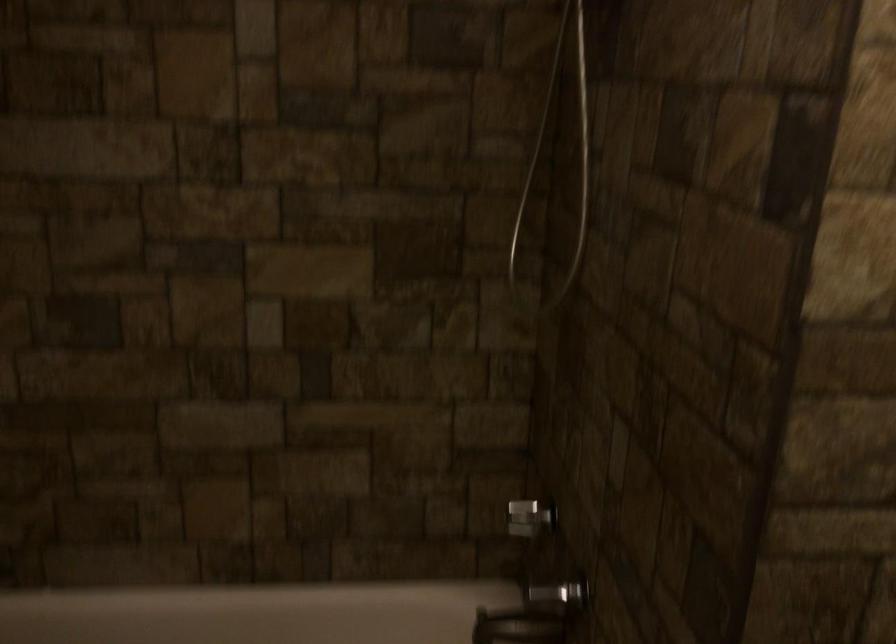
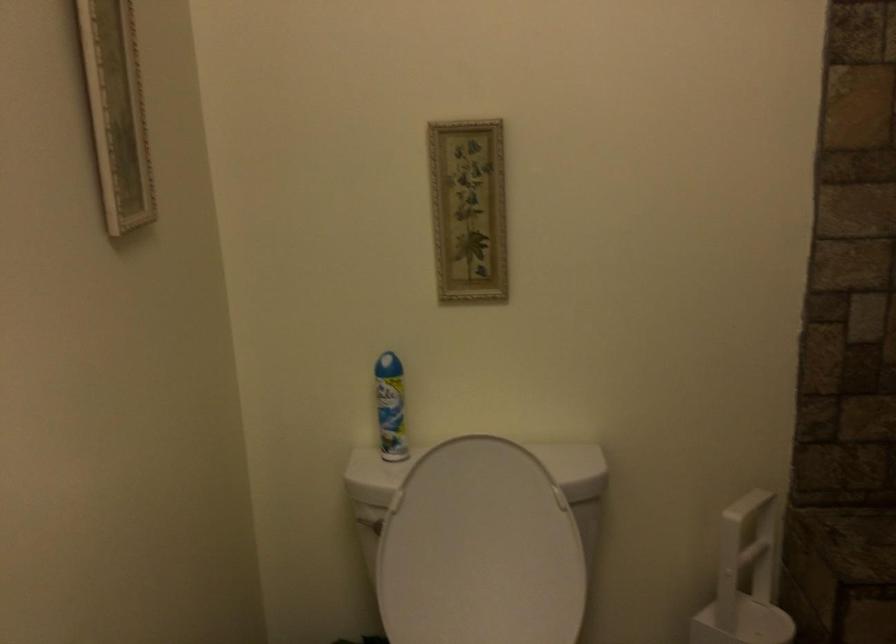
Question: Based on the continuous images, in which direction is the camera rotating? Reply with the corresponding letter.

Choices:
 (A) Left
 (B) Right
 (C) Up
 (D) Down

Answer: (A)